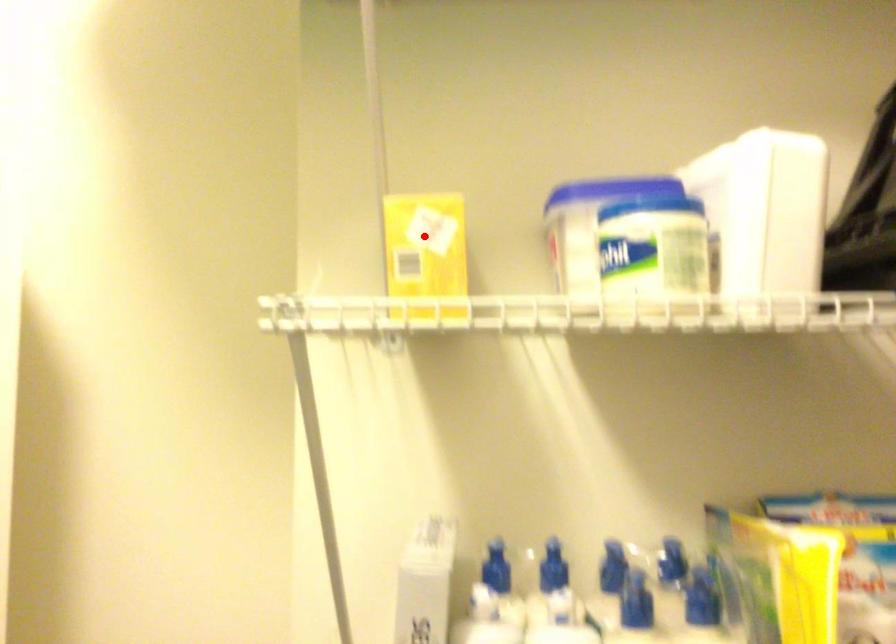
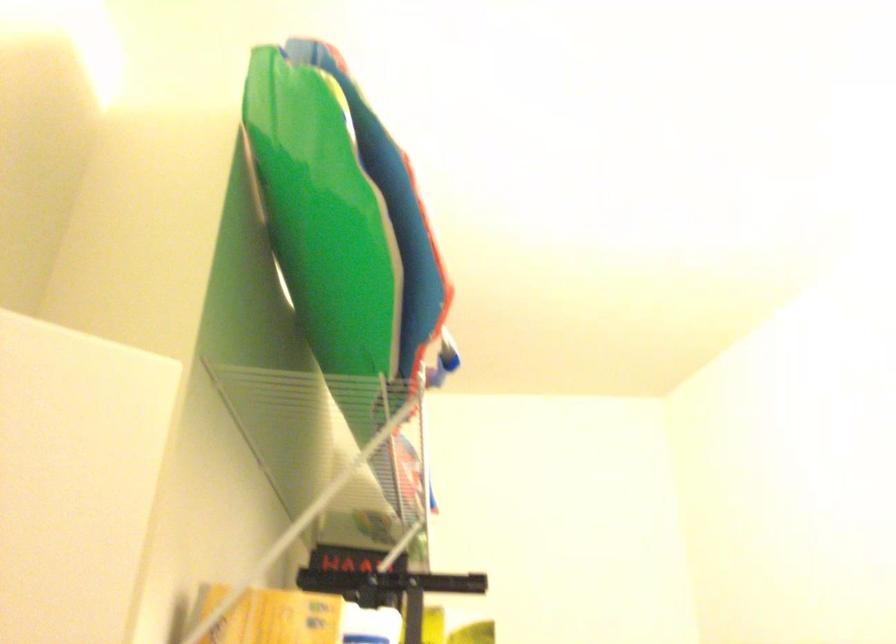
Locate, in the second image, the point that corresponds to the highlighted location in the first image.

(271, 617)